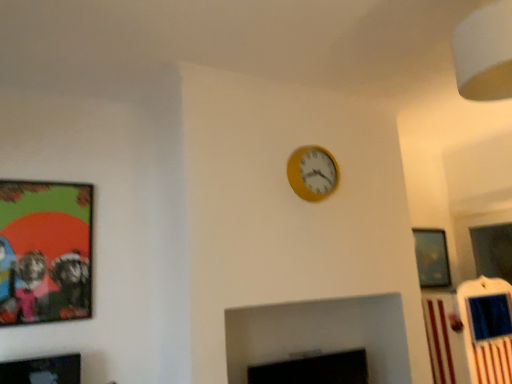
Question: From a real-world perspective, is metallic silver picture frame at upper right, which appears as the third picture frame when viewed from the front, positioned under black matte fireplace at lower center based on gravity?

Choices:
 (A) yes
 (B) no

Answer: (B)

Question: From the image's perspective, is metallic silver picture frame at upper right, which is the first picture frame from right to left, located beneath black matte fireplace at lower center?

Choices:
 (A) yes
 (B) no

Answer: (B)

Question: Is metallic silver picture frame at upper right, which is the first picture frame from right to left, at the left side of black matte fireplace at lower center?

Choices:
 (A) yes
 (B) no

Answer: (B)

Question: Is metallic silver picture frame at upper right, which is the third picture frame in left-to-right order, thinner than black matte fireplace at lower center?

Choices:
 (A) no
 (B) yes

Answer: (B)

Question: Is metallic silver picture frame at upper right, which appears as the third picture frame when viewed from the front, further to the viewer compared to black matte fireplace at lower center?

Choices:
 (A) no
 (B) yes

Answer: (B)

Question: Is metallic silver picture frame at upper right, which is the first picture frame from right to left, wider than black matte fireplace at lower center?

Choices:
 (A) no
 (B) yes

Answer: (A)

Question: Is black matte fireplace at lower center closer to the viewer compared to metallic silver picture frame at upper right, the 1th picture frame viewed from the back?

Choices:
 (A) no
 (B) yes

Answer: (B)

Question: From a real-world perspective, is black matte fireplace at lower center physically below metallic silver picture frame at upper right, the 1th picture frame viewed from the back?

Choices:
 (A) no
 (B) yes

Answer: (B)

Question: Is black matte fireplace at lower center to the left of metallic silver picture frame at upper right, which is the third picture frame in left-to-right order, from the viewer's perspective?

Choices:
 (A) no
 (B) yes

Answer: (B)

Question: From the image's perspective, is black matte fireplace at lower center beneath metallic silver picture frame at upper right, which is the first picture frame from right to left?

Choices:
 (A) yes
 (B) no

Answer: (A)

Question: Is black matte fireplace at lower center aimed at metallic silver picture frame at upper right, which appears as the third picture frame when viewed from the front?

Choices:
 (A) yes
 (B) no

Answer: (B)

Question: Is black matte fireplace at lower center wider than metallic silver picture frame at upper right, which is the first picture frame from right to left?

Choices:
 (A) no
 (B) yes

Answer: (B)

Question: Can you confirm if black matte fireplace at lower center is taller than yellow matte wall clock at upper center?

Choices:
 (A) yes
 (B) no

Answer: (B)